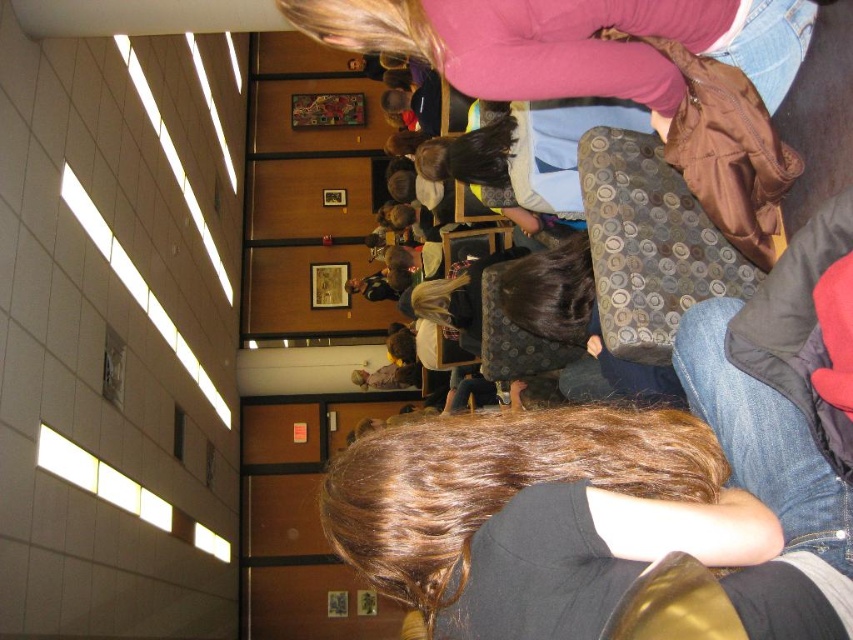
You are a photographer trying to capture a candid shot of the pink fleece sweater at upper center and the matte gray backpack at center in the rotated image. Since the sweater is shorter than the backpack, where should you position your camera to ensure both objects are fully visible in the frame?

The pink fleece sweater at upper center is not as tall as the matte gray backpack at center. To ensure both are fully visible, position the camera so that the backpack is lower in the frame, allowing space above for the sweater to be captured without cropping either object.

You are a photographer who needs to capture a clear shot of the matte gray backpack at center without the pink fleece sweater at upper center blocking it. How can you adjust your position to achieve this?

The pink fleece sweater at upper center is in front of the matte gray backpack at center. To capture a clear shot of the matte gray backpack at center without obstruction, move your camera position so that the pink fleece sweater at upper center is no longer between the backpack and the camera.